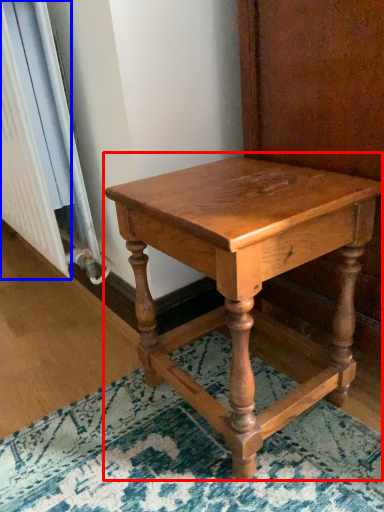
Question: Which object is further to the camera taking this photo, table (highlighted by a red box) or radiator (highlighted by a blue box)?

Choices:
 (A) table
 (B) radiator

Answer: (B)